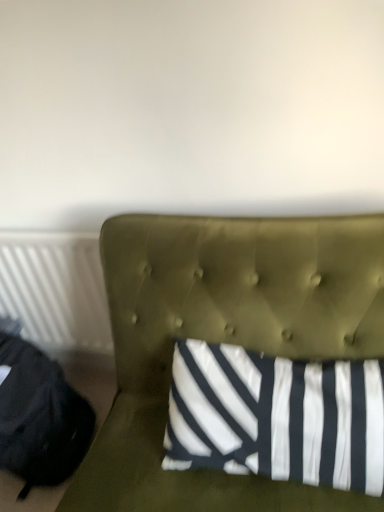
Question: Is black fabric bean bag chair at left to the left or to the right of olive green tufted headboard at center in the image?

Choices:
 (A) left
 (B) right

Answer: (A)

Question: From a real-world perspective, is black fabric bean bag chair at left positioned above or below olive green tufted headboard at center?

Choices:
 (A) above
 (B) below

Answer: (B)

Question: Based on their relative distances, which object is farther from the black fabric bean bag chair at left?

Choices:
 (A) olive green tufted headboard at center
 (B) white plastic radiator at left

Answer: (A)

Question: Which object is positioned farthest from the white plastic radiator at left?

Choices:
 (A) black fabric bean bag chair at left
 (B) olive green tufted headboard at center

Answer: (B)